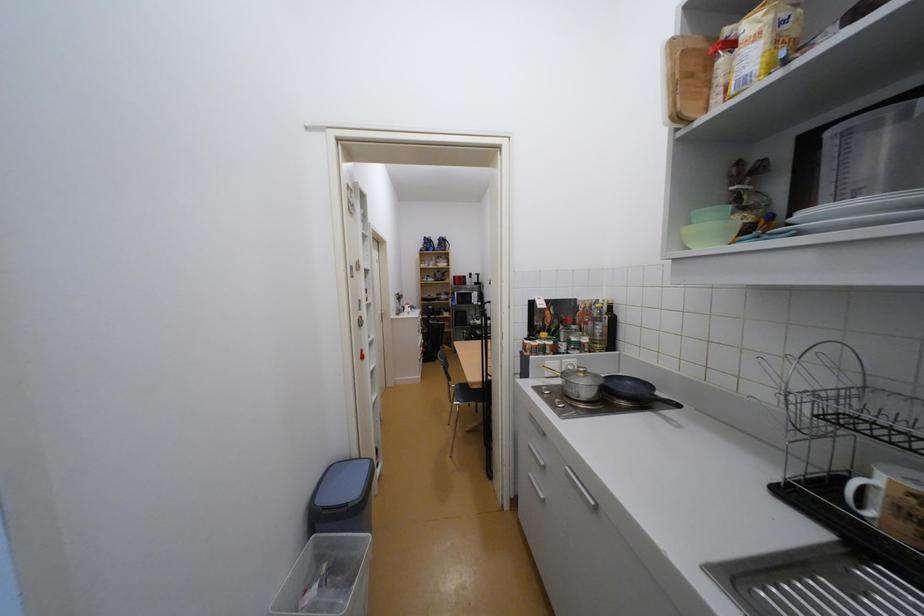
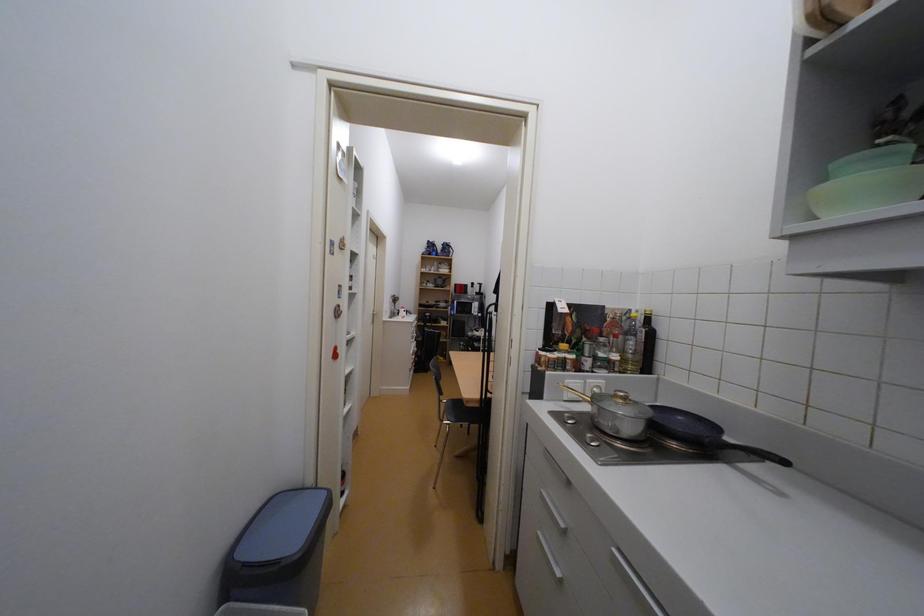
Question: The first image is from the beginning of the video and the second image is from the end. How did the camera likely rotate when shooting the video?

Choices:
 (A) Left
 (B) Right
 (C) Up
 (D) Down

Answer: (C)